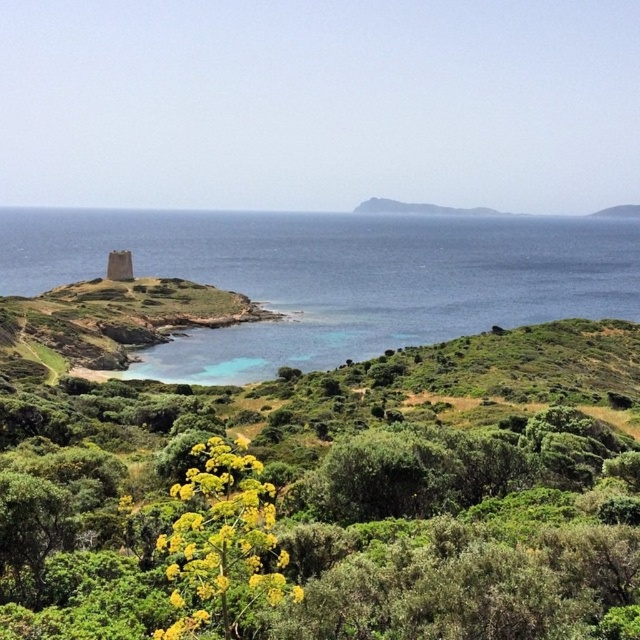
Does point (442, 285) come closer to viewer compared to point (124, 276)?

No.

Does blue water at left come behind white stone tower at upper left?

No.

The image size is (640, 640). In order to click on blue water at left in this screenshot , I will do (x=333, y=276).

Between point (352, 356) and point (221, 496), which one is positioned behind?

Point (352, 356)

Does point (609, 266) lie in front of point (204, 460)?

That is False.

Find the location of a particular element. blue water at left is located at coordinates (333, 276).

Between yellow flower at center and white stone tower at upper left, which one has more height?

Standing taller between the two is white stone tower at upper left.

Who is more forward, (273, 588) or (124, 278)?

Point (273, 588) is in front.

I want to click on yellow flower at center, so click(221, 547).